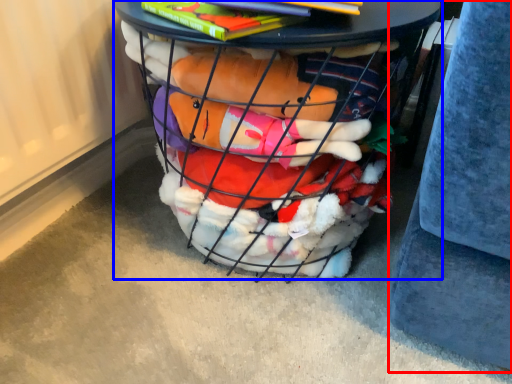
Question: Which object appears closest to the camera in this image, gray (highlighted by a red box) or furniture (highlighted by a blue box)?

Choices:
 (A) gray
 (B) furniture

Answer: (A)